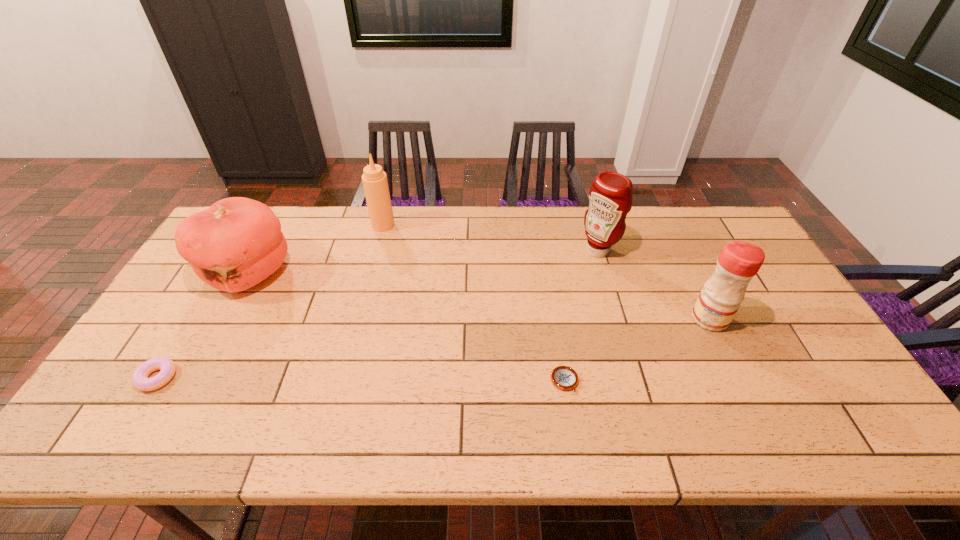
You are a GUI agent. You are given a task and a screenshot of the screen. Output one action in this format:
    pyautogui.click(x=<x>, y=<y>)
    Task: Click on the vacant area situated 0.280m on the left of the third object from left to right
    
    Given the screenshot: What is the action you would take?
    pyautogui.click(x=292, y=225)

Find the location of a particular element. The height and width of the screenshot is (540, 960). free point located on the front of the second nearest condiment is located at coordinates (623, 334).

You are a GUI agent. You are given a task and a screenshot of the screen. Output one action in this format:
    pyautogui.click(x=<x>, y=<y>)
    Task: Click on the vacant space located on the back of the third nearest object
    The image size is (960, 540).
    Given the screenshot: What is the action you would take?
    pyautogui.click(x=676, y=249)

Locate an element on the screen. The width and height of the screenshot is (960, 540). vacant point located 0.370m on the right of the pumpkin is located at coordinates (413, 272).

Locate an element on the screen. This screenshot has height=540, width=960. free location located 0.280m on the back of the doughnut is located at coordinates (214, 285).

You are a GUI agent. You are given a task and a screenshot of the screen. Output one action in this format:
    pyautogui.click(x=<x>, y=<y>)
    Task: Click on the free space located 0.390m on the right of the compass
    
    Given the screenshot: What is the action you would take?
    pyautogui.click(x=735, y=381)

Find the location of `pumpkin that is at the far edge`. pumpkin that is at the far edge is located at coordinates (235, 244).

The width and height of the screenshot is (960, 540). Identify the location of pumpkin present at the left edge. (235, 244).

Identify the location of doughnut that is at the left edge. This screenshot has width=960, height=540. (140, 380).

Where is `object that is at the far left corner`? Image resolution: width=960 pixels, height=540 pixels. object that is at the far left corner is located at coordinates (235, 244).